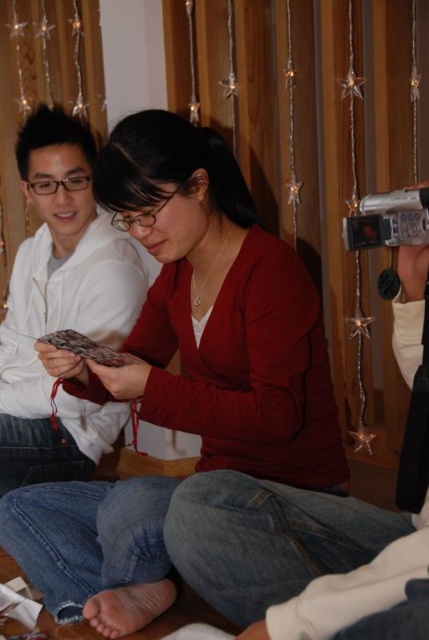
You are a photographer trying to capture a candid shot of the two people in the scene. The white matte sweater at left and the silver metallic video camera at upper right are both in your viewfinder. Which object should you adjust your focus to ensure the person in the foreground is sharp?

You should focus on the white matte sweater at left because it is closer to the viewer, indicating the person wearing it is in the foreground.

You are standing in the room and want to place a new decorative item exactly where the matte red sweater at center is located. What are the coordinates you should aim for?

The coordinates for the matte red sweater at center are at point (214, 312).

You are a photographer who needs to capture a closeup shot of the silver metallic video camera at upper right without including the matte red sweater at center in the frame. Given their sizes, is this feasible?

The matte red sweater at center is wider than the silver metallic video camera at upper right, so it might block the camera if positioned closely. However, by adjusting the camera angle or moving closer to the camera while framing carefully, it should be possible to exclude the sweater from the shot.